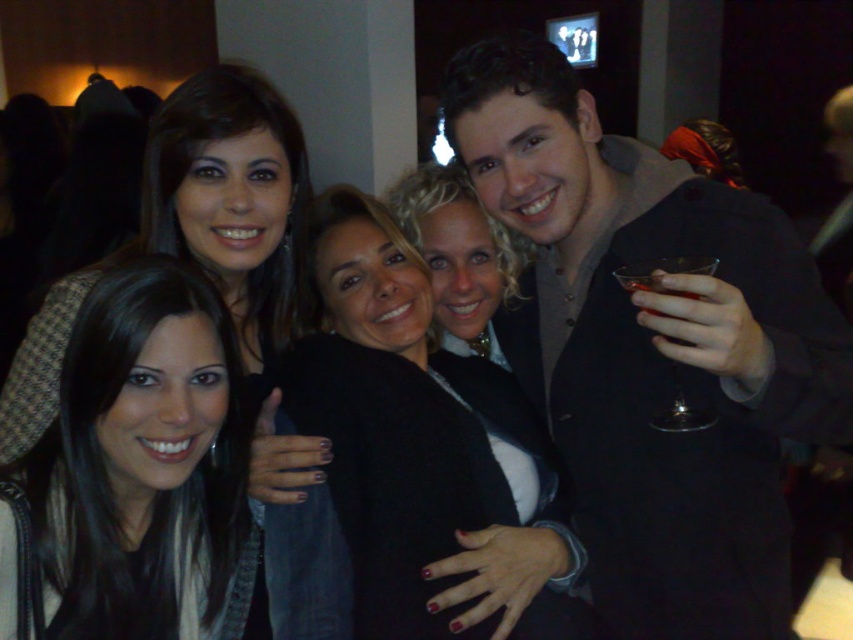
Question: Does black fuzzy sweater at center come behind translucent glass at upper right?

Choices:
 (A) yes
 (B) no

Answer: (A)

Question: Estimate the real-world distances between objects in this image. Which object is closer to the matte black jacket at upper left?

Choices:
 (A) translucent glass at upper right
 (B) black fuzzy sweater at center

Answer: (B)

Question: Is matte black jacket at upper left positioned in front of transparent glass at right?

Choices:
 (A) yes
 (B) no

Answer: (B)

Question: Is transparent glass at right thinner than translucent glass at upper right?

Choices:
 (A) no
 (B) yes

Answer: (A)

Question: Which point is closer to the camera?

Choices:
 (A) transparent glass at right
 (B) matte black suit at center
 (C) translucent glass at upper right

Answer: (B)

Question: Which of the following is the closest to the observer?

Choices:
 (A) black fuzzy sweater at center
 (B) transparent glass at right
 (C) matte black jacket at upper left
 (D) matte black suit at center

Answer: (D)